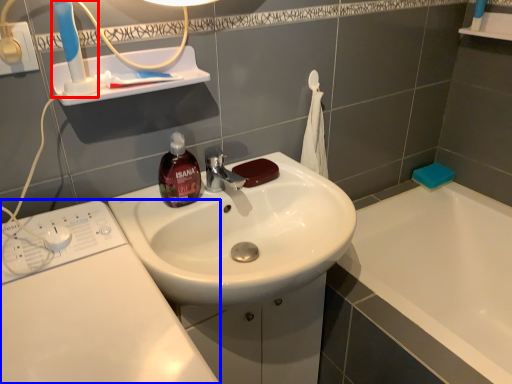
Question: Which object appears farthest to the camera in this image, toothbrush (highlighted by a red box) or washing machine (highlighted by a blue box)?

Choices:
 (A) toothbrush
 (B) washing machine

Answer: (A)